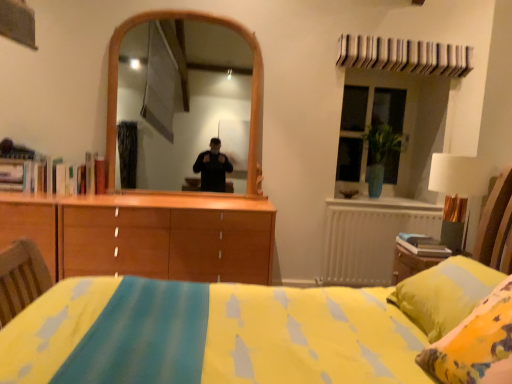
Question: Relative to white fabric lampshade at right, is green glass vase at upper right in front or behind?

Choices:
 (A) behind
 (B) front

Answer: (A)

Question: Visually, is green glass vase at upper right positioned to the left or to the right of white fabric lampshade at right?

Choices:
 (A) left
 (B) right

Answer: (B)

Question: Which of these objects is positioned farthest from the white fabric lampshade at right?

Choices:
 (A) green glass vase at upper right
 (B) white metallic radiator at right

Answer: (A)

Question: Which object is the farthest from the white fabric lampshade at right?

Choices:
 (A) green glass vase at upper right
 (B) white metallic radiator at right

Answer: (A)